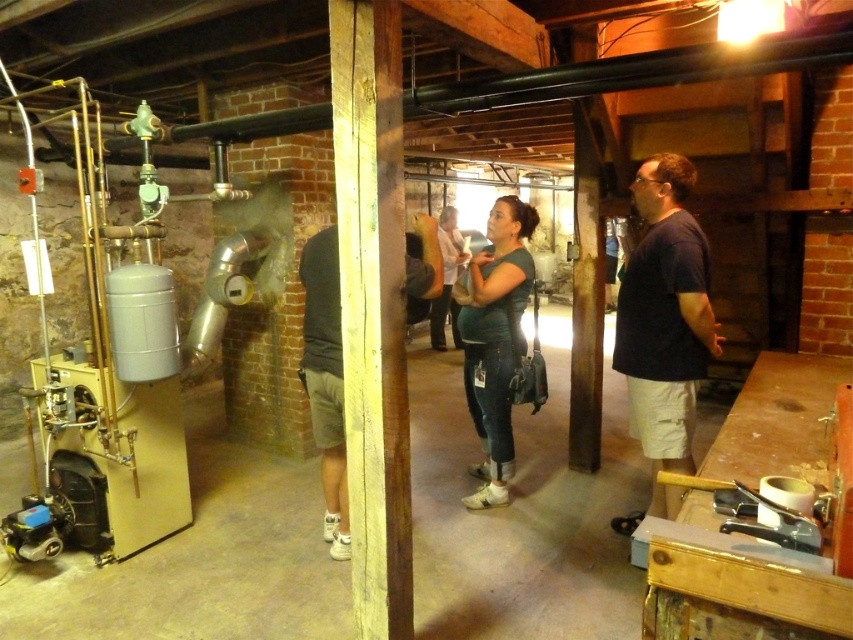
Which is in front, point (659, 232) or point (451, 237)?

Positioned in front is point (659, 232).

Can you confirm if dark blue t-shirt at right is thinner than matte green shirt at center?

Correct, dark blue t-shirt at right's width is less than matte green shirt at center's.

The image size is (853, 640). Describe the element at coordinates (664, 314) in the screenshot. I see `dark blue t-shirt at right` at that location.

This screenshot has height=640, width=853. Find the location of `dark blue t-shirt at right`. dark blue t-shirt at right is located at coordinates pos(664,314).

Who is more distant from viewer, (705,252) or (489,484)?

Point (489,484)

Can you confirm if dark blue t-shirt at right is thinner than dark green jersey at center?

No.

Which is behind, point (682, 166) or point (502, 275)?

Positioned behind is point (502, 275).

Where is `dark blue t-shirt at right`? The image size is (853, 640). dark blue t-shirt at right is located at coordinates (664, 314).

Between dark green jersey at center and matte green shirt at center, which one is positioned lower?

dark green jersey at center is below.

Measure the distance between dark green jersey at center and camera.

dark green jersey at center is 3.13 meters away from camera.

This screenshot has width=853, height=640. Identify the location of dark green jersey at center. (495, 340).